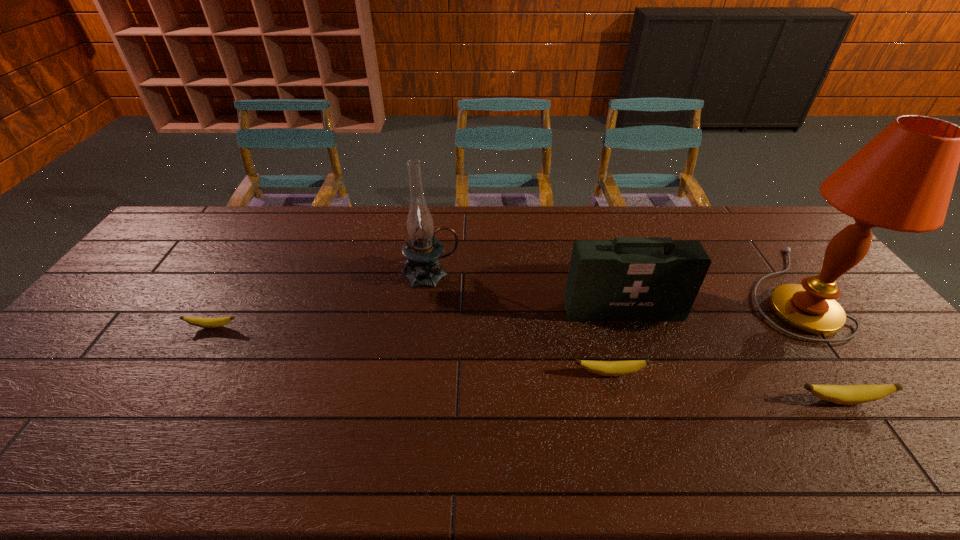
Locate an element on the screen. Image resolution: width=960 pixels, height=540 pixels. the leftmost banana is located at coordinates (201, 322).

Identify the location of the farthest banana. (201, 322).

The width and height of the screenshot is (960, 540). I want to click on the second tallest banana, so click(606, 368).

Locate an element on the screen. the second banana from left to right is located at coordinates (606, 368).

Locate an element on the screen. This screenshot has width=960, height=540. the fourth tallest object is located at coordinates (840, 394).

Locate an element on the screen. The image size is (960, 540). the nearest object is located at coordinates (840, 394).

The height and width of the screenshot is (540, 960). Find the location of `the fifth object from right to left`. the fifth object from right to left is located at coordinates (422, 250).

In order to click on the second tallest object in this screenshot , I will do `click(422, 250)`.

You are a GUI agent. You are given a task and a screenshot of the screen. Output one action in this format:
    pyautogui.click(x=<x>, y=<y>)
    Task: Click on the tallest object
    
    Given the screenshot: What is the action you would take?
    pyautogui.click(x=902, y=180)

The image size is (960, 540). I want to click on the third tallest object, so click(632, 279).